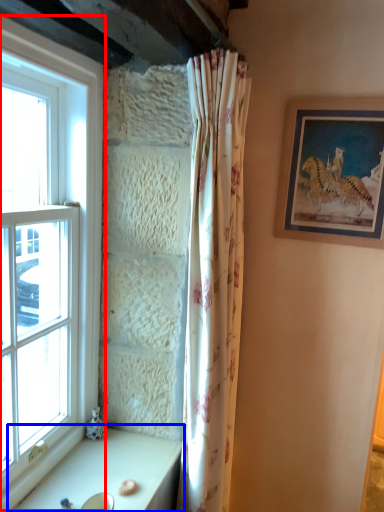
Question: Which object is further to the camera taking this photo, window (highlighted by a red box) or table (highlighted by a blue box)?

Choices:
 (A) window
 (B) table

Answer: (B)